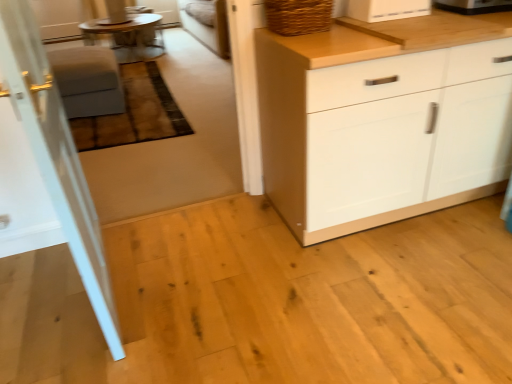
Question: Considering the relative sizes of matte gray stool at left and white glossy toaster at upper center, which appears as the 2th appliance when viewed from the right, in the image provided, is matte gray stool at left taller than white glossy toaster at upper center, which appears as the 2th appliance when viewed from the right,?

Choices:
 (A) yes
 (B) no

Answer: (A)

Question: Is the surface of matte gray stool at left in direct contact with white glossy toaster at upper center, placed as the 1th appliance when sorted from left to right?

Choices:
 (A) yes
 (B) no

Answer: (B)

Question: From the image's perspective, would you say matte gray stool at left is shown under white glossy toaster at upper center, which appears as the 2th appliance when viewed from the right?

Choices:
 (A) no
 (B) yes

Answer: (A)

Question: Considering the relative sizes of matte gray stool at left and white glossy toaster at upper center, placed as the 1th appliance when sorted from left to right, in the image provided, is matte gray stool at left smaller than white glossy toaster at upper center, placed as the 1th appliance when sorted from left to right,?

Choices:
 (A) no
 (B) yes

Answer: (A)

Question: Does matte gray stool at left have a lesser width compared to white glossy toaster at upper center, which appears as the 2th appliance when viewed from the right?

Choices:
 (A) no
 (B) yes

Answer: (A)

Question: Does matte gray stool at left have a lesser height compared to white glossy toaster at upper center, placed as the 1th appliance when sorted from left to right?

Choices:
 (A) yes
 (B) no

Answer: (B)

Question: Is black plastic toaster at upper right, which is counted as the 1th appliance, starting from the right, aimed at wooden round table at upper left?

Choices:
 (A) yes
 (B) no

Answer: (B)

Question: Is black plastic toaster at upper right, which is counted as the 1th appliance, starting from the right, facing away from wooden round table at upper left?

Choices:
 (A) no
 (B) yes

Answer: (A)

Question: Does black plastic toaster at upper right, which is the second appliance from left to right, have a lesser width compared to wooden round table at upper left?

Choices:
 (A) yes
 (B) no

Answer: (A)

Question: Does black plastic toaster at upper right, which is the second appliance from left to right, have a lesser height compared to wooden round table at upper left?

Choices:
 (A) no
 (B) yes

Answer: (B)

Question: Is black plastic toaster at upper right, which is counted as the 1th appliance, starting from the right, further to camera compared to wooden round table at upper left?

Choices:
 (A) no
 (B) yes

Answer: (A)

Question: Does black plastic toaster at upper right, which is counted as the 1th appliance, starting from the right, have a greater width compared to wooden round table at upper left?

Choices:
 (A) no
 (B) yes

Answer: (A)

Question: Would you say black plastic toaster at upper right, which is the second appliance from left to right, is part of white glossy door at left's contents?

Choices:
 (A) yes
 (B) no

Answer: (B)